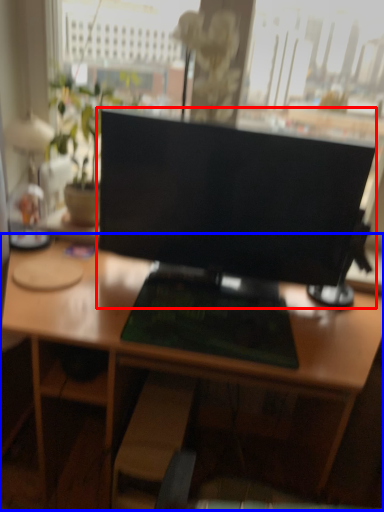
Question: Which of the following is the farthest to the observer, computer monitor (highlighted by a red box) or desk (highlighted by a blue box)?

Choices:
 (A) computer monitor
 (B) desk

Answer: (A)